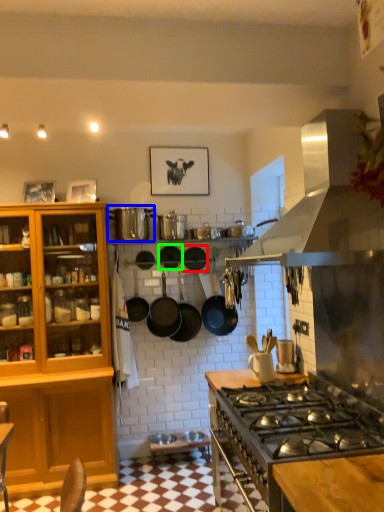
Question: Estimate the real-world distances between objects in this image. Which object is closer to frying pan (highlighted by a red box), appliance (highlighted by a blue box) or frying pan (highlighted by a green box)?

Choices:
 (A) appliance
 (B) frying pan

Answer: (B)